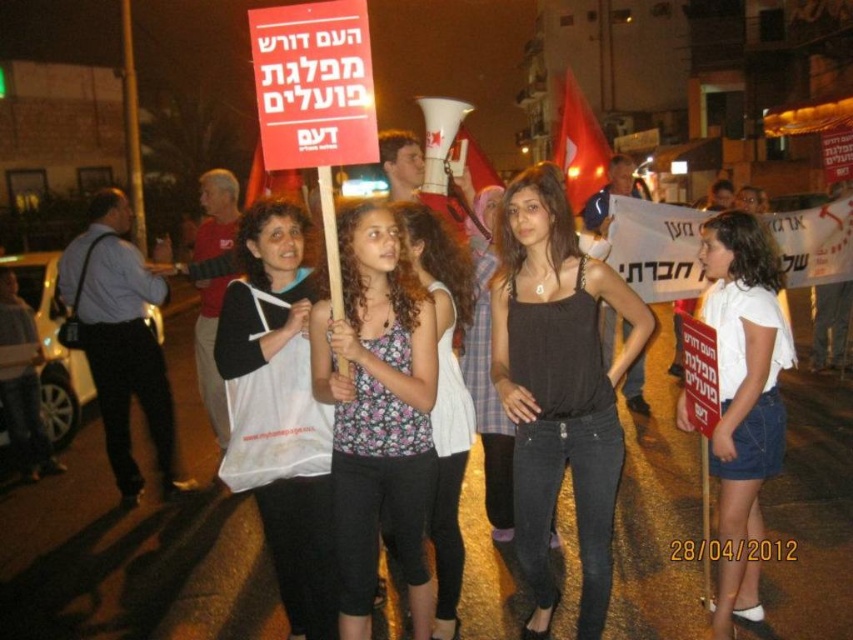
You are a GUI agent. You are given a task and a screenshot of the screen. Output one action in this format:
    pyautogui.click(x=<x>, y=<y>)
    Task: Click on the black matte tank top at center
    
    Given the screenshot: What is the action you would take?
    pyautogui.click(x=558, y=387)

Can you confirm if black matte tank top at center is positioned to the right of floral tank top at center?

Correct, you'll find black matte tank top at center to the right of floral tank top at center.

What do you see at coordinates (558, 387) in the screenshot?
I see `black matte tank top at center` at bounding box center [558, 387].

Locate an element on the screen. black matte tank top at center is located at coordinates (558, 387).

Is floral tank top at center thinner than white cotton shirt at center?

Yes.

Is the position of floral tank top at center more distant than that of white cotton shirt at center?

No, floral tank top at center is in front of white cotton shirt at center.

What do you see at coordinates (376, 412) in the screenshot? This screenshot has height=640, width=853. I see `floral tank top at center` at bounding box center [376, 412].

Find the location of a particular element. Image resolution: width=853 pixels, height=640 pixels. floral tank top at center is located at coordinates 376,412.

Can you confirm if white plastic bag at center is positioned to the right of floral fabric top at center?

Incorrect, white plastic bag at center is not on the right side of floral fabric top at center.

Who is positioned more to the right, white plastic bag at center or floral fabric top at center?

Positioned to the right is floral fabric top at center.

Is point (302, 269) closer to camera compared to point (421, 214)?

Yes, it is in front of point (421, 214).

Find the location of a particular element. The width and height of the screenshot is (853, 640). white plastic bag at center is located at coordinates (279, 412).